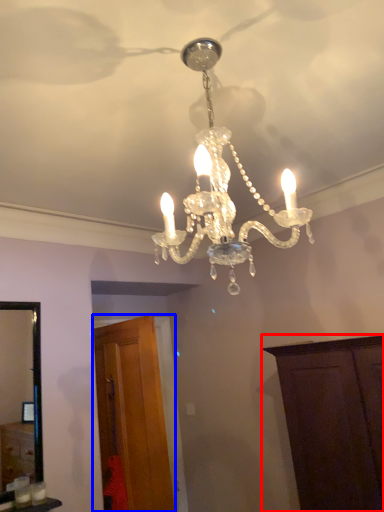
Question: Which point is closer to the camera, cabinetry (highlighted by a red box) or cabinetry (highlighted by a blue box)?

Choices:
 (A) cabinetry
 (B) cabinetry

Answer: (A)